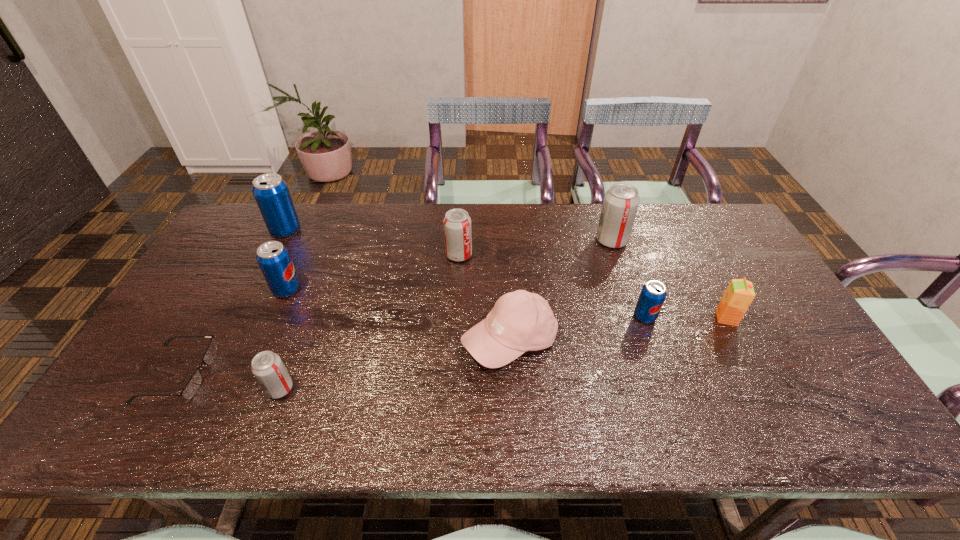
Identify the location of free space located 0.330m on the right of the smallest blue pop soda. (776, 317).

Where is `blank space located on the back of the nearest gray soda can`? This screenshot has height=540, width=960. blank space located on the back of the nearest gray soda can is located at coordinates (314, 297).

Image resolution: width=960 pixels, height=540 pixels. What are the coordinates of `vacant space located 0.170m on the front-facing side of the spectacles` in the screenshot? It's located at (278, 373).

The height and width of the screenshot is (540, 960). Find the location of `pop soda that is at the left edge`. pop soda that is at the left edge is located at coordinates (271, 192).

At what (x,y) coordinates should I click in order to perform the action: click on spectacles that is at the left edge. Please return your answer as a coordinate pair (x, y). The height and width of the screenshot is (540, 960). Looking at the image, I should click on (194, 383).

Find the location of a particular element. The image size is (960, 540). object at the right edge is located at coordinates (740, 293).

This screenshot has height=540, width=960. Find the location of `object that is positioned at the far left corner`. object that is positioned at the far left corner is located at coordinates (271, 192).

Locate an element on the screen. vacant space at the far edge of the desktop is located at coordinates (372, 210).

Where is `vacant space at the near edge of the desktop`? This screenshot has width=960, height=540. vacant space at the near edge of the desktop is located at coordinates (178, 424).

Identify the location of vacant space at the right edge of the desktop. This screenshot has width=960, height=540. (761, 302).